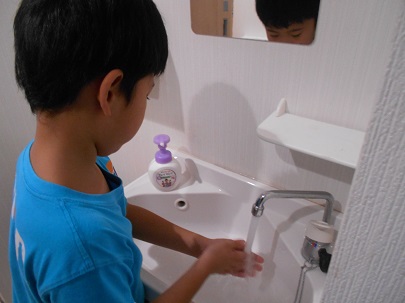
This screenshot has width=405, height=303. What are the coordinates of `handwash pump` in the screenshot? It's located at (161, 140).